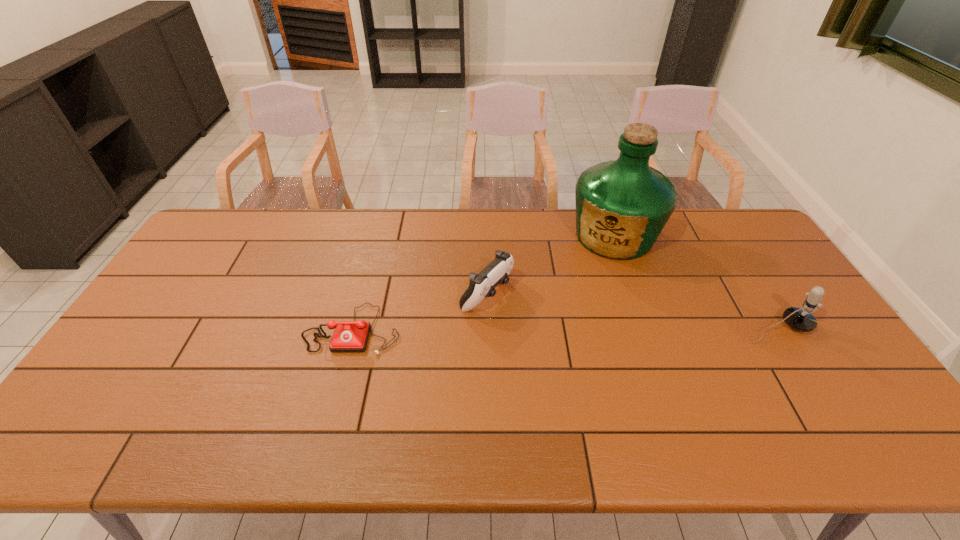
Identify the location of vacant space on the desktop that is between the telephone and the rightmost object and is positioned on the front-facing side of the second object from left to right. (548, 329).

Find the location of `vacant spot on the desktop that is between the leftmost object and the rightmost object and is positioned on the label side of the tallest object`. vacant spot on the desktop that is between the leftmost object and the rightmost object and is positioned on the label side of the tallest object is located at coordinates (552, 329).